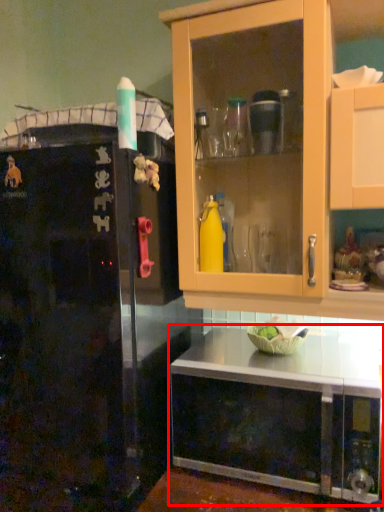
Question: From the image's perspective, what is the correct spatial relationship of cabinetry (annotated by the red box) in relation to refrigerator?

Choices:
 (A) above
 (B) below

Answer: (A)